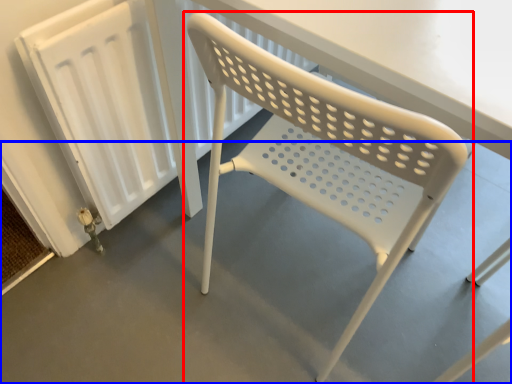
Question: Which object appears closest to the camera in this image, chair (highlighted by a red box) or concrete (highlighted by a blue box)?

Choices:
 (A) chair
 (B) concrete

Answer: (A)